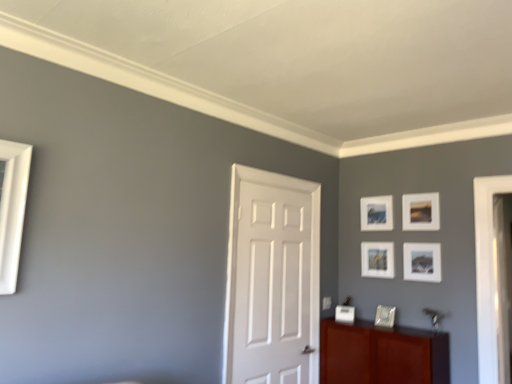
Question: Is mahogany wood cabinet at lower right with matte white picture frame at upper right, positioned as the first picture frame in top-to-bottom order?

Choices:
 (A) no
 (B) yes

Answer: (A)

Question: Does mahogany wood cabinet at lower right have a lesser width compared to matte white picture frame at upper right, placed as the fifth picture frame when sorted from bottom to top?

Choices:
 (A) yes
 (B) no

Answer: (B)

Question: Is mahogany wood cabinet at lower right not inside matte white picture frame at upper right, placed as the fifth picture frame when sorted from bottom to top?

Choices:
 (A) yes
 (B) no

Answer: (A)

Question: From the image's perspective, does mahogany wood cabinet at lower right appear lower than matte white picture frame at upper right, positioned as the first picture frame in top-to-bottom order?

Choices:
 (A) no
 (B) yes

Answer: (B)

Question: Is mahogany wood cabinet at lower right smaller than matte white picture frame at upper right, positioned as the first picture frame in top-to-bottom order?

Choices:
 (A) no
 (B) yes

Answer: (A)

Question: Is matte white picture frame at upper right, which appears as the third picture frame when ordered from the bottom, wider or thinner than mahogany wood cabinet at lower right?

Choices:
 (A) wide
 (B) thin

Answer: (B)

Question: Do you think matte white picture frame at upper right, which appears as the third picture frame when ordered from the bottom, is within mahogany wood cabinet at lower right, or outside of it?

Choices:
 (A) inside
 (B) outside

Answer: (B)

Question: In terms of height, does matte white picture frame at upper right, which appears as the third picture frame when ordered from the bottom, look taller or shorter compared to mahogany wood cabinet at lower right?

Choices:
 (A) tall
 (B) short

Answer: (B)

Question: Looking at the image, does matte white picture frame at upper right, which appears as the third picture frame when ordered from the bottom, seem bigger or smaller compared to mahogany wood cabinet at lower right?

Choices:
 (A) small
 (B) big

Answer: (A)

Question: Looking at their shapes, would you say mahogany wood cabinet at lower right is wider or thinner than white matte picture frame at upper right, which appears as the fourth picture frame when ordered from the bottom?

Choices:
 (A) thin
 (B) wide

Answer: (B)

Question: Based on their positions, is mahogany wood cabinet at lower right located to the left or right of white matte picture frame at upper right, which appears as the fourth picture frame when ordered from the bottom?

Choices:
 (A) right
 (B) left

Answer: (B)

Question: From the image's perspective, is mahogany wood cabinet at lower right above or below white matte picture frame at upper right, positioned as the second picture frame in top-to-bottom order?

Choices:
 (A) below
 (B) above

Answer: (A)

Question: Considering their positions, is mahogany wood cabinet at lower right located in front of or behind white matte picture frame at upper right, positioned as the second picture frame in top-to-bottom order?

Choices:
 (A) front
 (B) behind

Answer: (A)

Question: From the image's perspective, is matte white picture frame at center, which ranks as the 2th picture frame in bottom-to-top order, positioned above or below matte white picture frame at upper right, which appears as the third picture frame when ordered from the bottom?

Choices:
 (A) above
 (B) below

Answer: (B)

Question: In the image, is matte white picture frame at center, which is counted as the fourth picture frame, starting from the top, positioned in front of or behind matte white picture frame at upper right, the third picture frame when ordered from top to bottom?

Choices:
 (A) front
 (B) behind

Answer: (B)